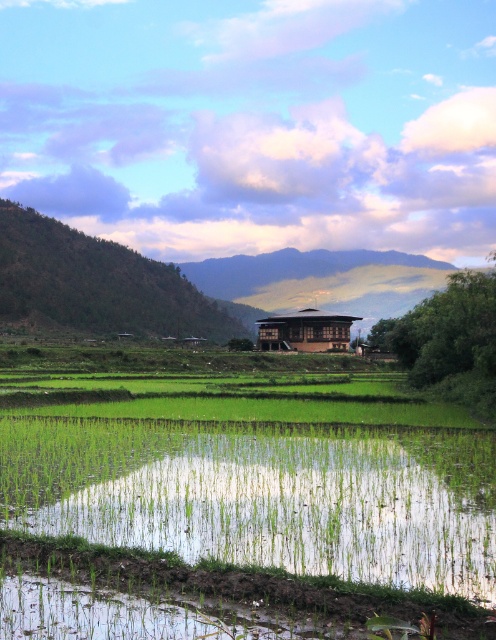
Consider the image. You are standing in the serene rural landscape and want to take a photo of both the green grassy field at center and the brown wooden hut at center. Which object should you focus on first to ensure both are in clear view?

You should focus on the green grassy field at center first because it is closer to you than the brown wooden hut at center, so adjusting focus from near to far will help both be in clear view.

You are standing at the point marked as point (232, 496) in the image. What do you see directly in front of you?

You see the green grassy field at center directly in front of you at point (232, 496).